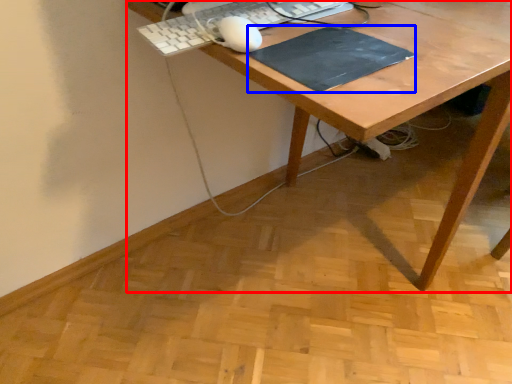
Question: Which object appears farthest to the camera in this image, desk (highlighted by a red box) or mousepad (highlighted by a blue box)?

Choices:
 (A) desk
 (B) mousepad

Answer: (B)